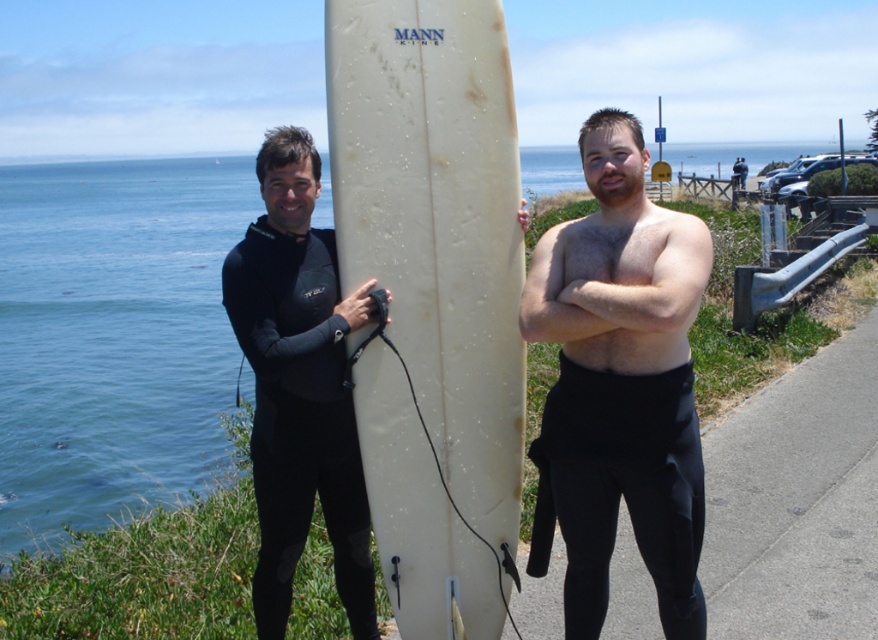
Measure the distance between point (407, 634) and camera.

The distance of point (407, 634) from camera is 3.27 meters.

Is black matte wetsuit at center positioned in front of black matte wetsuit at left?

Yes, it is in front of black matte wetsuit at left.

At what (x,y) coordinates should I click in order to perform the action: click on black matte wetsuit at center. Please return your answer as a coordinate pair (x, y). This screenshot has width=878, height=640. Looking at the image, I should click on (619, 385).

Does shiny black wetsuit at center have a lesser width compared to hairy skin at center?

No.

Locate an element on the screen. shiny black wetsuit at center is located at coordinates (619, 385).

This screenshot has width=878, height=640. I want to click on shiny black wetsuit at center, so click(x=619, y=385).

Can you confirm if white matte surfboard at center is positioned above shiny black wetsuit at center?

Yes.

Who is positioned more to the left, white matte surfboard at center or shiny black wetsuit at center?

white matte surfboard at center is more to the left.

Locate an element on the screen. The image size is (878, 640). white matte surfboard at center is located at coordinates (437, 224).